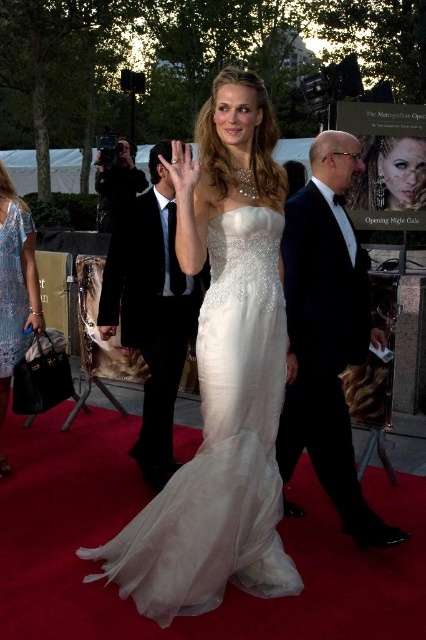
You are a photographer at the event and need to capture a closeup shot of the black satin tuxedo at right and the shiny black suit at center. Since your camera can only focus on one subject at a time, which one should you choose to ensure the entire garment fits in the frame?

Answer: The black satin tuxedo at right occupies less space than the shiny black suit at center, so you should choose the black satin tuxedo at right to ensure the entire garment fits in the frame.

You are a photographer at the event and need to capture a photo that includes both the shiny black suit at center and the shiny blue dress at lower left. Based on their positions, which one should you focus on first to ensure both are in frame?

The shiny black suit at center is above the shiny blue dress at lower left, so you should focus on the shiny blue dress at lower left first to ensure both are in frame.

You are a photographer at the event and need to capture a photo that includes both the shiny black suit at center and the shiny blue dress at lower left. Based on their positions, which object should you position your camera to focus on first to ensure both are in frame?

The shiny blue dress at lower left should be positioned first since the shiny black suit at center is to the right of it, so by focusing on the shiny blue dress at lower left, you can adjust the camera to include both objects in the frame.